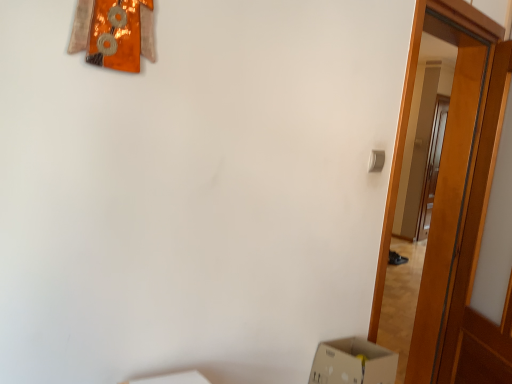
Question: Is wooden door at right, which is the 1th door in left-to-right order, shorter than wooden door at right, acting as the 2th door starting from the left?

Choices:
 (A) yes
 (B) no

Answer: (B)

Question: Considering the relative sizes of wooden door at right, the second door in the right-to-left sequence, and wooden door at right, acting as the 1th door starting from the right, in the image provided, is wooden door at right, the second door in the right-to-left sequence, smaller than wooden door at right, acting as the 1th door starting from the right,?

Choices:
 (A) no
 (B) yes

Answer: (A)

Question: Is wooden door at right, which is the 1th door in left-to-right order, thinner than wooden door at right, acting as the 2th door starting from the left?

Choices:
 (A) yes
 (B) no

Answer: (B)

Question: Is wooden door at right, the second door in the right-to-left sequence, to the right of wooden door at right, acting as the 2th door starting from the left, from the viewer's perspective?

Choices:
 (A) yes
 (B) no

Answer: (B)

Question: From the image's perspective, is wooden door at right, the second door in the right-to-left sequence, located beneath wooden door at right, acting as the 2th door starting from the left?

Choices:
 (A) no
 (B) yes

Answer: (A)

Question: Is wooden door at right, the second door in the right-to-left sequence, directly adjacent to wooden door at right, acting as the 1th door starting from the right?

Choices:
 (A) no
 (B) yes

Answer: (A)

Question: Considering the relative sizes of wooden door at right, acting as the 1th door starting from the right, and wooden door at right, which is the 1th door in left-to-right order, in the image provided, is wooden door at right, acting as the 1th door starting from the right, shorter than wooden door at right, which is the 1th door in left-to-right order,?

Choices:
 (A) no
 (B) yes

Answer: (B)

Question: Does wooden door at right, acting as the 2th door starting from the left, have a greater width compared to wooden door at right, which is the 1th door in left-to-right order?

Choices:
 (A) yes
 (B) no

Answer: (B)

Question: Is wooden door at right, which is the 1th door in left-to-right order, at the back of wooden door at right, acting as the 2th door starting from the left?

Choices:
 (A) yes
 (B) no

Answer: (A)

Question: Is wooden door at right, acting as the 2th door starting from the left, at the left side of wooden door at right, which is the 1th door in left-to-right order?

Choices:
 (A) no
 (B) yes

Answer: (A)

Question: Is wooden door at right, acting as the 1th door starting from the right, far from wooden door at right, which is the 1th door in left-to-right order?

Choices:
 (A) yes
 (B) no

Answer: (B)

Question: Considering the relative sizes of wooden door at right, acting as the 1th door starting from the right, and wooden door at right, the second door in the right-to-left sequence, in the image provided, is wooden door at right, acting as the 1th door starting from the right, bigger than wooden door at right, the second door in the right-to-left sequence,?

Choices:
 (A) no
 (B) yes

Answer: (A)

Question: Is wooden door at right, acting as the 1th door starting from the right, inside or outside of wooden door at right, the second door in the right-to-left sequence?

Choices:
 (A) inside
 (B) outside

Answer: (B)